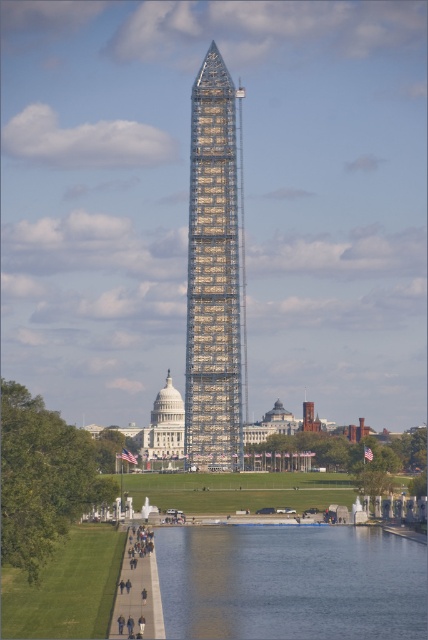
Is point (193, 538) positioned after point (196, 269)?

Yes.

Who is positioned more to the right, smooth reflective water at lower center or shiny glass tower at center?

smooth reflective water at lower center is more to the right.

Who is more distant from viewer, (341, 618) or (211, 48)?

Positioned behind is point (211, 48).

This screenshot has width=428, height=640. Identify the location of smooth reflective water at lower center. (291, 582).

The image size is (428, 640). What are the coordinates of `shiny glass tower at center` in the screenshot? It's located at (214, 275).

Who is more forward, (219,248) or (130,563)?

Point (219,248)

Find the location of a particular element. The height and width of the screenshot is (640, 428). shiny glass tower at center is located at coordinates (214, 275).

Between point (190, 632) and point (116, 618), which one is positioned behind?

The point (116, 618) is behind.

From the picture: Is smooth reflective water at lower center wider than dark gray concrete people at lower center?

Yes, smooth reflective water at lower center is wider than dark gray concrete people at lower center.

Identify the location of smooth reflective water at lower center. (291, 582).

Identify the location of smooth reflective water at lower center. (291, 582).